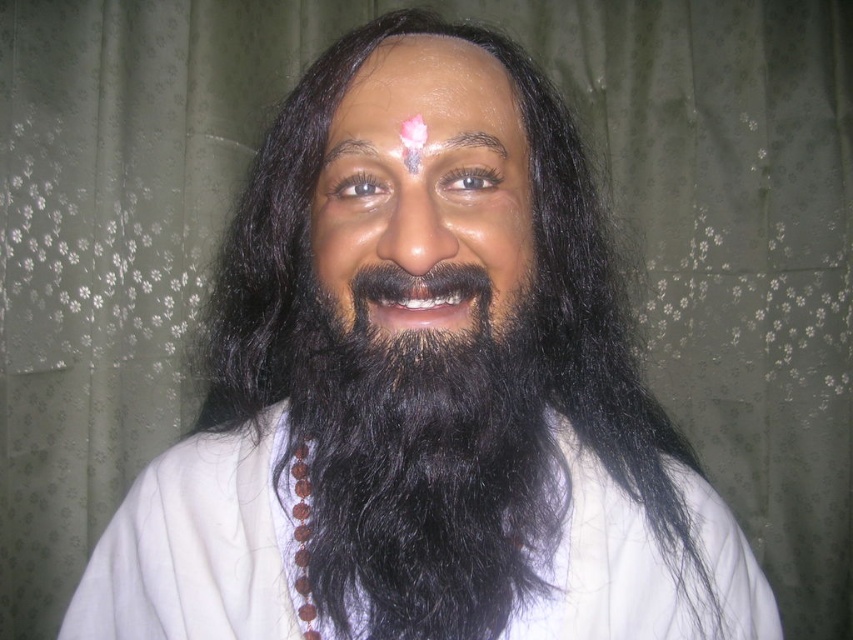
The height and width of the screenshot is (640, 853). Identify the location of smooth skin face at center. (425, 195).

Is smooth skin face at center behind matte skin forehead at center?

No, it is in front of matte skin forehead at center.

I want to click on smooth skin face at center, so click(425, 195).

This screenshot has width=853, height=640. What do you see at coordinates (419, 465) in the screenshot?
I see `black fuzzy beard at center` at bounding box center [419, 465].

The height and width of the screenshot is (640, 853). Describe the element at coordinates (419, 465) in the screenshot. I see `black fuzzy beard at center` at that location.

This screenshot has height=640, width=853. Find the location of `black fuzzy beard at center`. black fuzzy beard at center is located at coordinates (419, 465).

Which is above, smooth skin face at center or dark brown hair at upper center?

Positioned higher is dark brown hair at upper center.

Between point (432, 278) and point (374, 145), which one is positioned behind?

The point (374, 145) is behind.

Where is `smooth skin face at center`? This screenshot has height=640, width=853. smooth skin face at center is located at coordinates (425, 195).